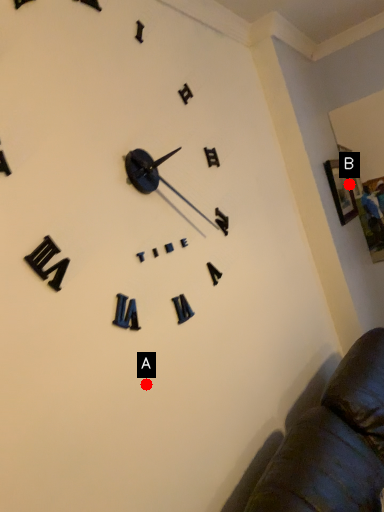
Question: Two points are circled on the image, labeled by A and B beside each circle. Which of the following is the farthest from the observer?

Choices:
 (A) A is further
 (B) B is further

Answer: (B)